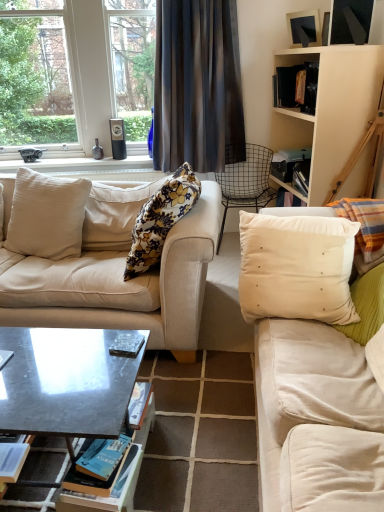
Locate an element on the screen. The height and width of the screenshot is (512, 384). free location above matte black speaker at upper left (from a real-world perspective) is located at coordinates (83, 159).